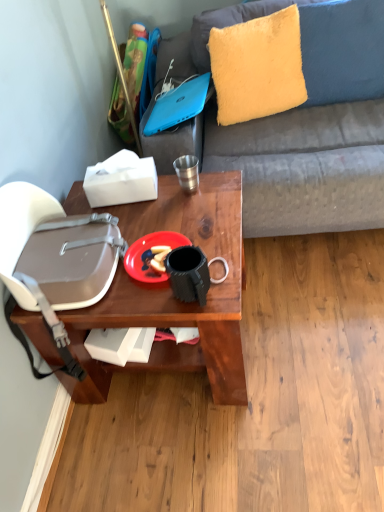
Find the location of `free space in front of plastic matte plate at center`. free space in front of plastic matte plate at center is located at coordinates (155, 301).